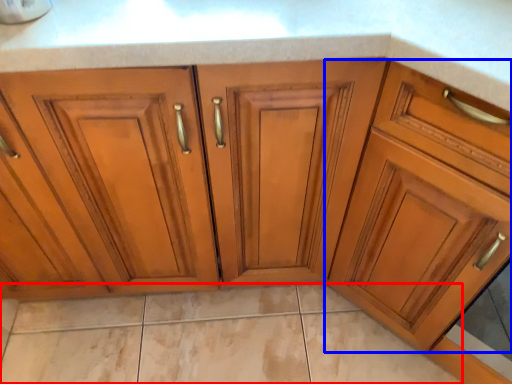
Question: Among these objects, which one is farthest to the camera, granite (highlighted by a red box) or cabinetry (highlighted by a blue box)?

Choices:
 (A) granite
 (B) cabinetry

Answer: (A)